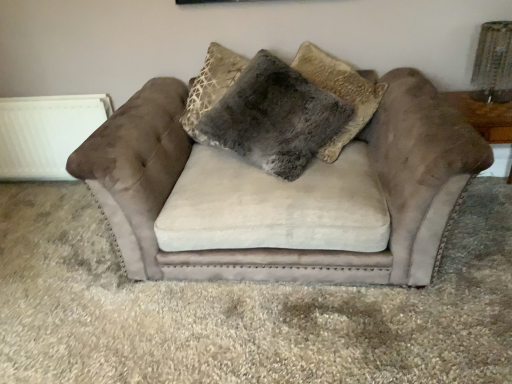
Locate an element on the screen. The width and height of the screenshot is (512, 384). fuzzy gray pillow at center is located at coordinates (275, 117).

The width and height of the screenshot is (512, 384). I want to click on brown suede table at right, so click(484, 116).

Identify the location of fuzzy gray pillow at center. (275, 117).

Is the position of brown suede table at right more distant than that of fuzzy gray pillow at center?

Yes.

In terms of size, does brown suede table at right appear bigger or smaller than fuzzy gray pillow at center?

brown suede table at right is smaller than fuzzy gray pillow at center.

Is brown suede table at right wider than fuzzy gray pillow at center?

In fact, brown suede table at right might be narrower than fuzzy gray pillow at center.

Is brown suede table at right turned away from fuzzy gray pillow at center?

brown suede table at right is not turned away from fuzzy gray pillow at center.

Would you say fuzzy gray pillow at center is a long distance from white matte radiator at left?

That's right, there is a large distance between fuzzy gray pillow at center and white matte radiator at left.

Can you confirm if fuzzy gray pillow at center is positioned to the right of white matte radiator at left?

Indeed, fuzzy gray pillow at center is positioned on the right side of white matte radiator at left.

Considering the sizes of objects fuzzy gray pillow at center and white matte radiator at left in the image provided, who is wider, fuzzy gray pillow at center or white matte radiator at left?

fuzzy gray pillow at center is wider.

From a real-world perspective, does brown suede table at right sit lower than suede couch at center?

Yes, from a real-world perspective, brown suede table at right is under suede couch at center.

Where is `table below the suede couch at center (from a real-world perspective)`? Image resolution: width=512 pixels, height=384 pixels. table below the suede couch at center (from a real-world perspective) is located at coordinates (484, 116).

How different are the orientations of brown suede table at right and suede couch at center in degrees?

The angular difference between brown suede table at right and suede couch at center is 0.000446 degrees.

Is brown suede table at right aimed at suede couch at center?

No, brown suede table at right does not turn towards suede couch at center.

From a real-world perspective, is fuzzy gray pillow at center located higher than suede couch at center?

Correct, in the physical world, fuzzy gray pillow at center is higher than suede couch at center.

Can you confirm if fuzzy gray pillow at center is bigger than suede couch at center?

Incorrect, fuzzy gray pillow at center is not larger than suede couch at center.

Which is farther from the camera, (228, 141) or (194, 151)?

Positioned behind is point (194, 151).

Considering the sizes of objects fuzzy gray pillow at center and suede couch at center in the image provided, who is wider, fuzzy gray pillow at center or suede couch at center?

With larger width is suede couch at center.

Locate an element on the screen. This screenshot has height=384, width=512. table that appears on the right of fuzzy gray pillow at center is located at coordinates click(x=484, y=116).

Is fuzzy gray pillow at center with brown suede table at right?

No.

From a real-world perspective, is fuzzy gray pillow at center above or below brown suede table at right?

Clearly, from a real-world perspective, fuzzy gray pillow at center is above brown suede table at right.

Which object is closer to the camera taking this photo, fuzzy gray pillow at center or brown suede table at right?

fuzzy gray pillow at center is in front.

At what (x,y) coordinates should I click in order to perform the action: click on studio couch in front of the fuzzy gray pillow at center. Please return your answer as a coordinate pair (x, y). This screenshot has height=384, width=512. Looking at the image, I should click on (282, 193).

Is suede couch at center positioned behind fuzzy gray pillow at center?

No, suede couch at center is in front of fuzzy gray pillow at center.

From the image's perspective, is suede couch at center beneath fuzzy gray pillow at center?

Correct, suede couch at center appears lower than fuzzy gray pillow at center in the image.

What's the angular difference between suede couch at center and fuzzy gray pillow at center's facing directions?

suede couch at center and fuzzy gray pillow at center are facing 8.42 degrees away from each other.

Is white matte radiator at left taller than fuzzy gray pillow at center?

Incorrect, the height of white matte radiator at left is not larger of that of fuzzy gray pillow at center.

At what (x,y) coordinates should I click in order to perform the action: click on radiator behind the fuzzy gray pillow at center. Please return your answer as a coordinate pair (x, y). Looking at the image, I should click on (46, 133).

Is white matte radiator at left to the left or to the right of fuzzy gray pillow at center in the image?

Clearly, white matte radiator at left is on the left of fuzzy gray pillow at center in the image.

Does white matte radiator at left have a greater width compared to fuzzy gray pillow at center?

No.

At what (x,y) coordinates should I click in order to perform the action: click on table directly beneath the fuzzy gray pillow at center (from a real-world perspective). Please return your answer as a coordinate pair (x, y). This screenshot has height=384, width=512. Looking at the image, I should click on (484, 116).

The width and height of the screenshot is (512, 384). Identify the location of radiator behind the fuzzy gray pillow at center. (46, 133).

Looking at the image, which one is located further to brown suede table at right, suede couch at center or white matte radiator at left?

The object further to brown suede table at right is white matte radiator at left.

From the image, which object appears to be nearer to white matte radiator at left, brown suede table at right or suede couch at center?

Based on the image, suede couch at center appears to be nearer to white matte radiator at left.

Considering their positions, is white matte radiator at left positioned further to suede couch at center than fuzzy gray pillow at center?

white matte radiator at left lies further to suede couch at center than the other object.

Looking at the image, which one is located further to white matte radiator at left, suede couch at center or brown suede table at right?

The object further to white matte radiator at left is brown suede table at right.

From the picture: From the image, which object appears to be nearer to brown suede table at right, suede couch at center or fuzzy gray pillow at center?

fuzzy gray pillow at center is closer to brown suede table at right.

Considering their positions, is fuzzy gray pillow at center positioned further to white matte radiator at left than brown suede table at right?

Based on the image, brown suede table at right appears to be further to white matte radiator at left.

Looking at the image, which one is located closer to brown suede table at right, white matte radiator at left or fuzzy gray pillow at center?

fuzzy gray pillow at center.

Looking at the image, which one is located further to suede couch at center, fuzzy gray pillow at center or white matte radiator at left?

Based on the image, white matte radiator at left appears to be further to suede couch at center.

This screenshot has width=512, height=384. Find the location of `pillow located between white matte radiator at left and brown suede table at right in the left-right direction`. pillow located between white matte radiator at left and brown suede table at right in the left-right direction is located at coordinates (275, 117).

Locate an element on the screen. The height and width of the screenshot is (384, 512). studio couch situated between white matte radiator at left and brown suede table at right from left to right is located at coordinates (282, 193).

Where is `studio couch situated between fuzzy gray pillow at center and brown suede table at right from left to right`? studio couch situated between fuzzy gray pillow at center and brown suede table at right from left to right is located at coordinates (282, 193).

You are a GUI agent. You are given a task and a screenshot of the screen. Output one action in this format:
    pyautogui.click(x=<x>, y=<y>)
    Task: Click on the pillow between white matte radiator at left and suede couch at center in the horizontal direction
    This screenshot has width=512, height=384.
    Given the screenshot: What is the action you would take?
    pyautogui.click(x=275, y=117)